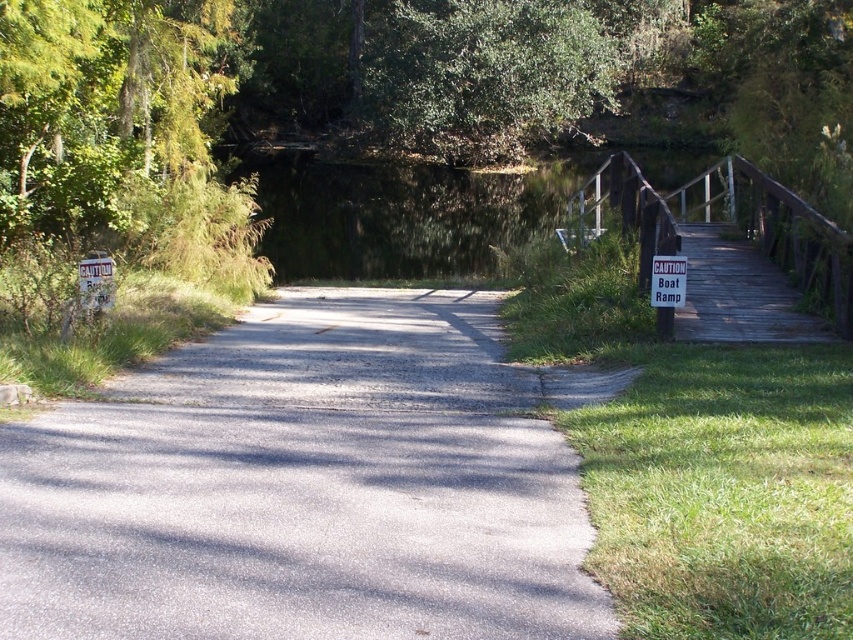
You are standing at the start of the road and want to know the exact position of the green leafy tree at upper center. What are its coordinates?

The green leafy tree at upper center is located at coordinates (480, 76).

You are a hiker walking along the road in the scene. You notice the green leafy tree at upper center and the wooden bridge at right. Which object appears wider from your perspective?

The green leafy tree at upper center appears wider than the wooden bridge at right because its width is larger than the bridge.

You are standing at the point with coordinates point [666,275] and want to walk to the point with coordinates point [389,58]. Which direction should you face to move towards your destination?

You should face towards the direction opposite of point [666,275] because point [389,58] is behind it.